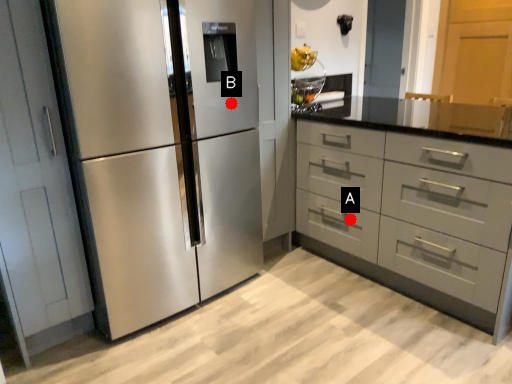
Question: Two points are circled on the image, labeled by A and B beside each circle. Which point is closer to the camera?

Choices:
 (A) A is closer
 (B) B is closer

Answer: (B)